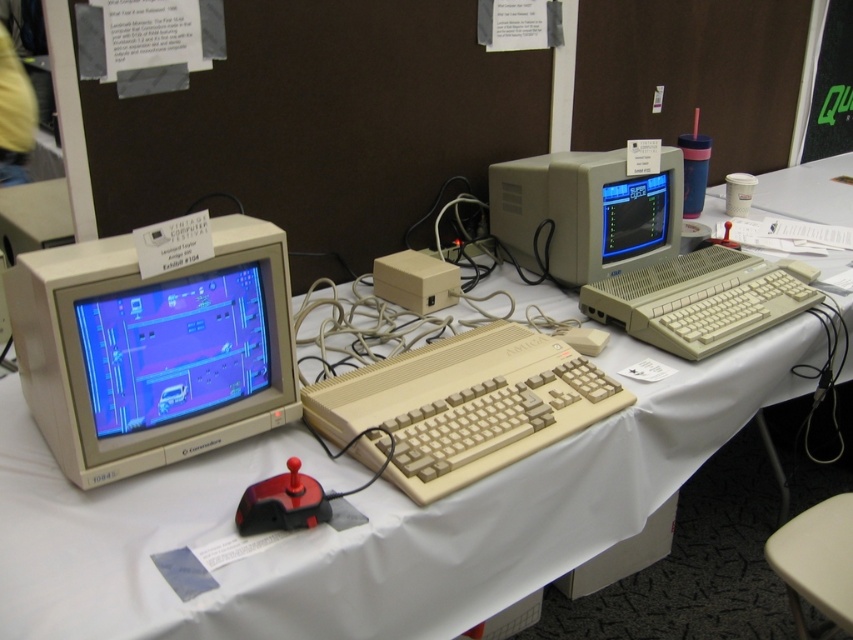
You are setting up a display for a retro computing exhibition. You have a shiny blue crt monitor at left and a rubberized black mouse at center. Where should you place a new decorative item so that it doesn not block the mouse or the monitor?

Place the decorative item to the right of the rubberized black mouse at center, as the shiny blue crt monitor at left is positioned under it, leaving space on the right side unoccupied.

You are standing in front of the retro computer setup. There are two points marked on the table. The first point is at coordinates point (16, 275) and the second point is at point (665, 234). Which point is closer to you?

Point (16, 275) is closer to the viewer than point (665, 234).

You are a tech enthusiast at the exhibition and want to connect the shiny blue crt monitor at left to the rubberized black mouse at center. Which object should you move to make space for the cable?

The shiny blue crt monitor at left is positioned on the left side of the rubberized black mouse at center. To make space for the cable, you should move the shiny blue crt monitor at left to the left or the rubberized black mouse at center to the right.